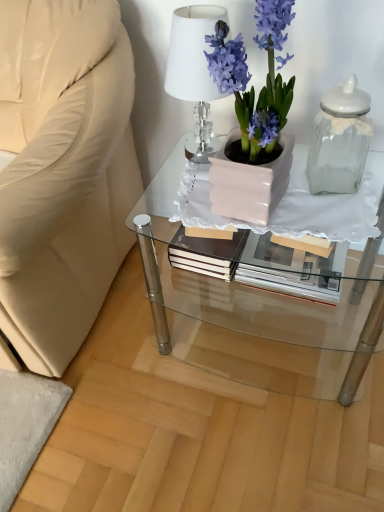
The image size is (384, 512). What are the coordinates of `vacant point above matte white glass table at center (from a real-world perspective)` in the screenshot? It's located at click(301, 188).